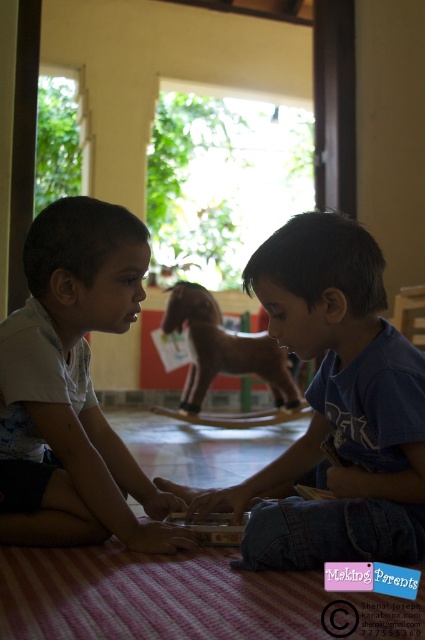
Question: Which object is positioned closest to the white matte shirt at left?

Choices:
 (A) wooden horse at center
 (B) blue cotton shirt at center

Answer: (B)

Question: Does blue cotton shirt at center appear on the left side of white matte shirt at left?

Choices:
 (A) yes
 (B) no

Answer: (B)

Question: Which point is closer to the camera taking this photo?

Choices:
 (A) (85, 243)
 (B) (399, 458)
 (C) (198, 307)

Answer: (B)

Question: Which of these objects is positioned farthest from the blue cotton shirt at center?

Choices:
 (A) white matte shirt at left
 (B) wooden horse at center

Answer: (B)

Question: Is blue cotton shirt at center to the right of wooden horse at center from the viewer's perspective?

Choices:
 (A) no
 (B) yes

Answer: (B)

Question: Does blue cotton shirt at center come behind wooden horse at center?

Choices:
 (A) no
 (B) yes

Answer: (A)